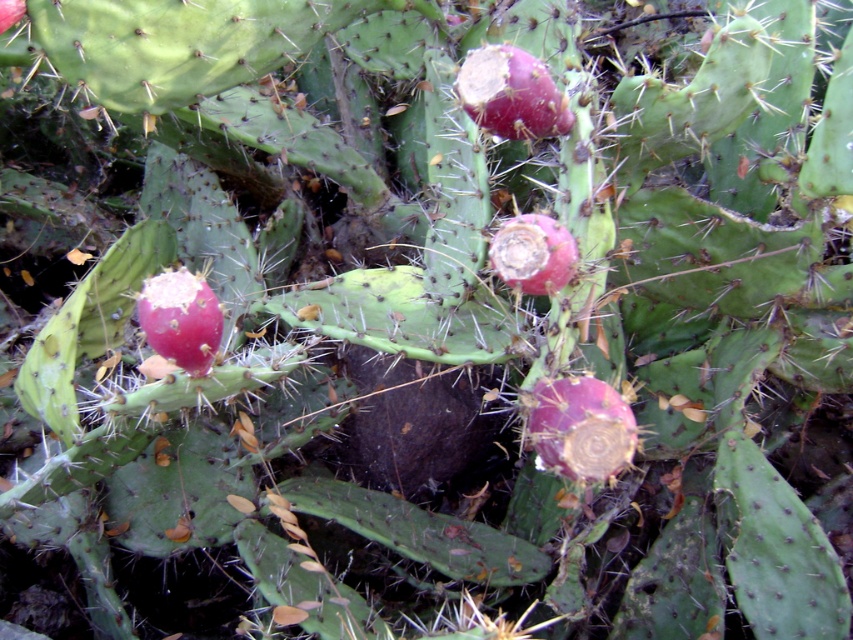
You are a botanist examining two cactus fruits in the image. The fruits are the purple matte prickly pear cactus fruit at center and the matte pink cactus fruit at center. Which fruit is taller?

The purple matte prickly pear cactus fruit at center is taller than the matte pink cactus fruit at center.

You are an artist planning to paint the prickly pear cactus and its fruits. You want to ensure the size relationship between the pink matte prickly pear cactus fruit at center and the smooth red cactus fruit at center is accurate. Which fruit should you paint as the larger one?

The smooth red cactus fruit at center should be painted as the larger one since the pink matte prickly pear cactus fruit at center is smaller than it.